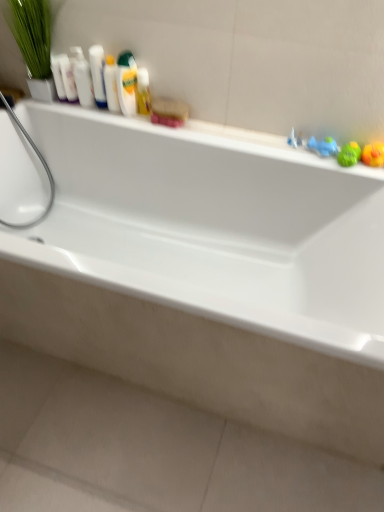
Question: From a real-world perspective, is translucent plastic mouthwash at upper center, the fifth mouthwash when ordered from left to right, over white glossy bottles at upper left?

Choices:
 (A) yes
 (B) no

Answer: (B)

Question: Is translucent plastic mouthwash at upper center, marked as the 2th mouthwash in a right-to-left arrangement, far from white glossy bottles at upper left?

Choices:
 (A) yes
 (B) no

Answer: (B)

Question: From the image's perspective, is translucent plastic mouthwash at upper center, marked as the 2th mouthwash in a right-to-left arrangement, located above white glossy bottles at upper left?

Choices:
 (A) no
 (B) yes

Answer: (A)

Question: Does translucent plastic mouthwash at upper center, marked as the 2th mouthwash in a right-to-left arrangement, have a greater width compared to white glossy bottles at upper left?

Choices:
 (A) yes
 (B) no

Answer: (A)

Question: Can you confirm if translucent plastic mouthwash at upper center, marked as the 2th mouthwash in a right-to-left arrangement, is smaller than white glossy bottles at upper left?

Choices:
 (A) no
 (B) yes

Answer: (A)

Question: From the image's perspective, is translucent plastic mouthwash at upper center, the fifth mouthwash when ordered from left to right, beneath white glossy bottles at upper left?

Choices:
 (A) no
 (B) yes

Answer: (B)

Question: Does green leafy plant at upper left have a smaller size compared to translucent plastic mouthwash at upper left, which is counted as the 4th mouthwash, starting from the left?

Choices:
 (A) yes
 (B) no

Answer: (B)

Question: Considering the relative sizes of green leafy plant at upper left and translucent plastic mouthwash at upper left, which is the third mouthwash from right to left, in the image provided, is green leafy plant at upper left taller than translucent plastic mouthwash at upper left, which is the third mouthwash from right to left,?

Choices:
 (A) no
 (B) yes

Answer: (B)

Question: Is green leafy plant at upper left to the right of translucent plastic mouthwash at upper left, which is counted as the 4th mouthwash, starting from the left, from the viewer's perspective?

Choices:
 (A) no
 (B) yes

Answer: (A)

Question: Is green leafy plant at upper left bigger than translucent plastic mouthwash at upper left, which is the third mouthwash from right to left?

Choices:
 (A) no
 (B) yes

Answer: (B)

Question: From a real-world perspective, is green leafy plant at upper left positioned under translucent plastic mouthwash at upper left, which is the third mouthwash from right to left, based on gravity?

Choices:
 (A) yes
 (B) no

Answer: (B)

Question: Is the depth of green leafy plant at upper left less than that of translucent plastic mouthwash at upper left, which is counted as the 4th mouthwash, starting from the left?

Choices:
 (A) no
 (B) yes

Answer: (B)

Question: Is green rubber duck at right, placed as the 2th toy when sorted from right to left, bigger than white glossy mouthwash at upper left, the third mouthwash when ordered from left to right?

Choices:
 (A) yes
 (B) no

Answer: (B)